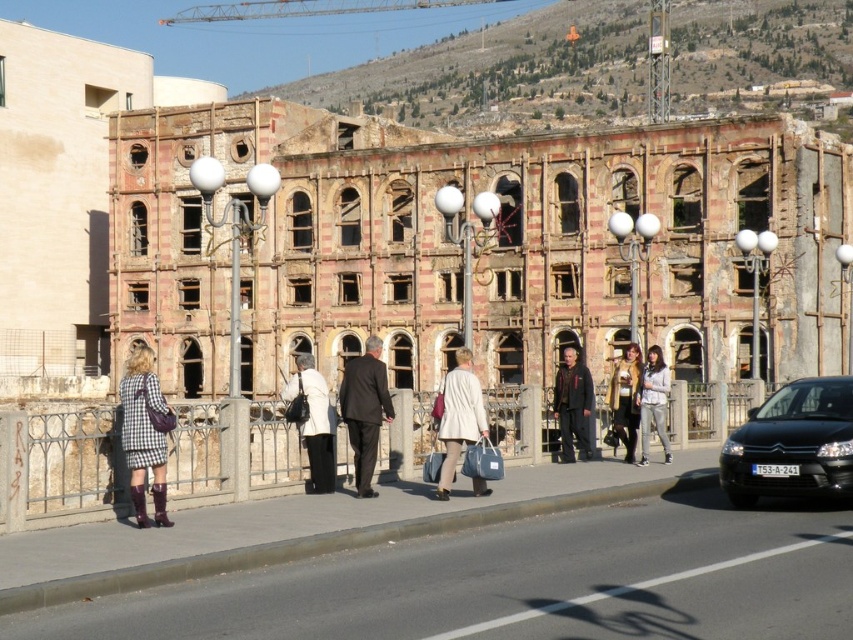
Question: Estimate the real-world distances between objects in this image. Which object is closer to the light gray fabric jacket at center?

Choices:
 (A) light beige coat at center
 (B) dark brown leather coat at center

Answer: (B)

Question: Which object appears farthest from the camera in this image?

Choices:
 (A) checkered fabric dress at left
 (B) stone textured fence at center
 (C) dark brown suit at center
 (D) yellow textured scarf at center

Answer: (D)

Question: Which is nearer to the checkered fabric dress at left?

Choices:
 (A) dark brown leather coat at center
 (B) yellow textured scarf at center
 (C) stone textured fence at center

Answer: (C)

Question: Is the position of black matte car at right more distant than that of yellow textured scarf at center?

Choices:
 (A) yes
 (B) no

Answer: (B)

Question: Can you confirm if light beige coat at center is positioned above dark brown leather coat at center?

Choices:
 (A) no
 (B) yes

Answer: (B)

Question: Can you confirm if stone textured fence at center is thinner than light gray fabric jacket at center?

Choices:
 (A) no
 (B) yes

Answer: (A)